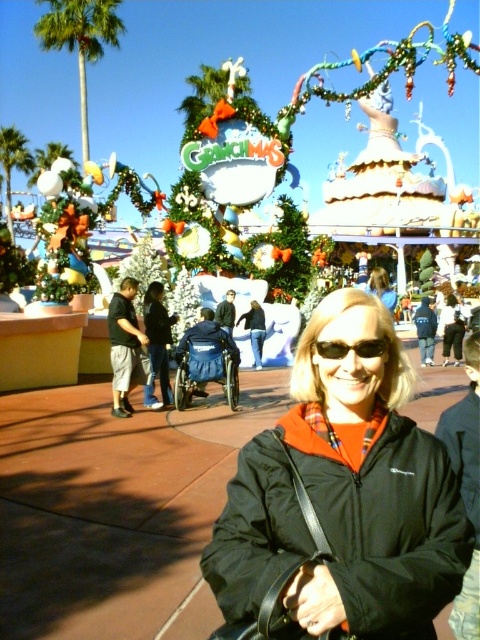
You are a photographer adjusting your camera settings to focus on the black matte jacket at center and the black plastic sunglasses at center. Which object should you adjust the focus for first if you want to start with the larger object?

The black matte jacket at center is bigger than the black plastic sunglasses at center, so you should focus on the black matte jacket at center first.

You are a photographer trying to capture the festive scene. You notice the black plastic sunglasses at center and the matte blue shirt at center. Which object is located to the left of the other?

The black plastic sunglasses at center is positioned on the left side of matte blue shirt at center.